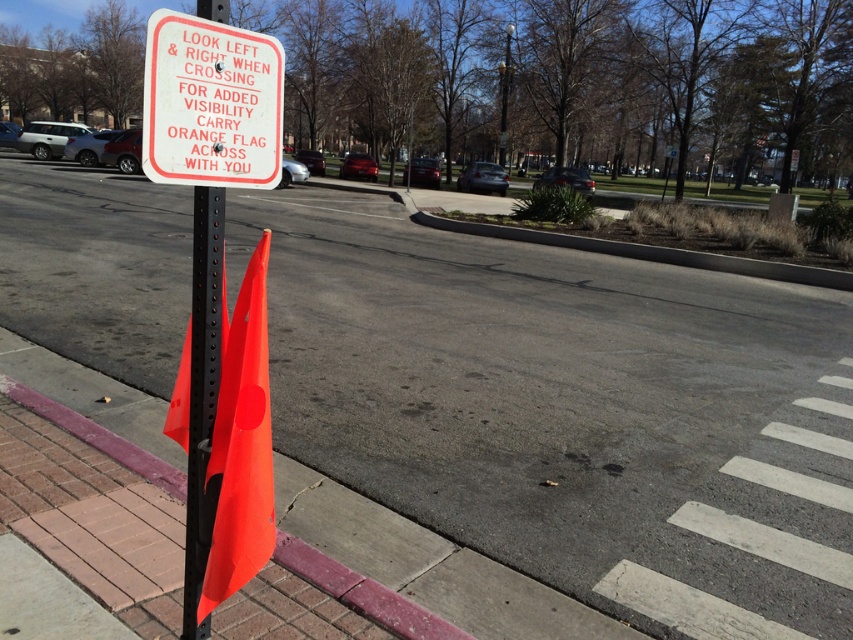
You are a pedestrian planning to cross the street. You notice the white plastic sign at upper center and the black textured pole at left. According to the scene, which object is shorter?

The white plastic sign at upper center is shorter than the black textured pole at left.

You are standing at the crosswalk on the right side of the street and see the point marked at coordinate (212, 102). What object is located at that point?

The point at coordinate (212, 102) marks the white plastic sign at upper center.